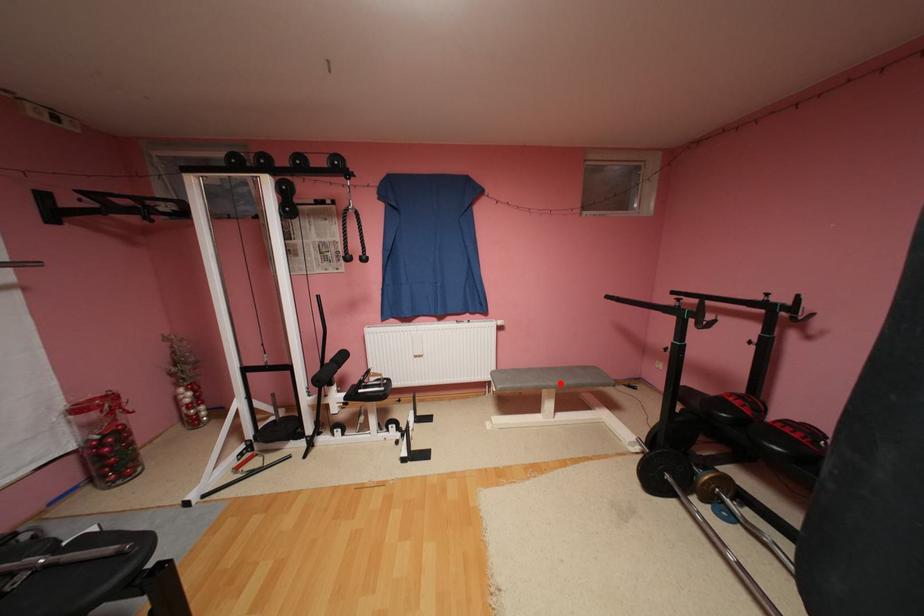
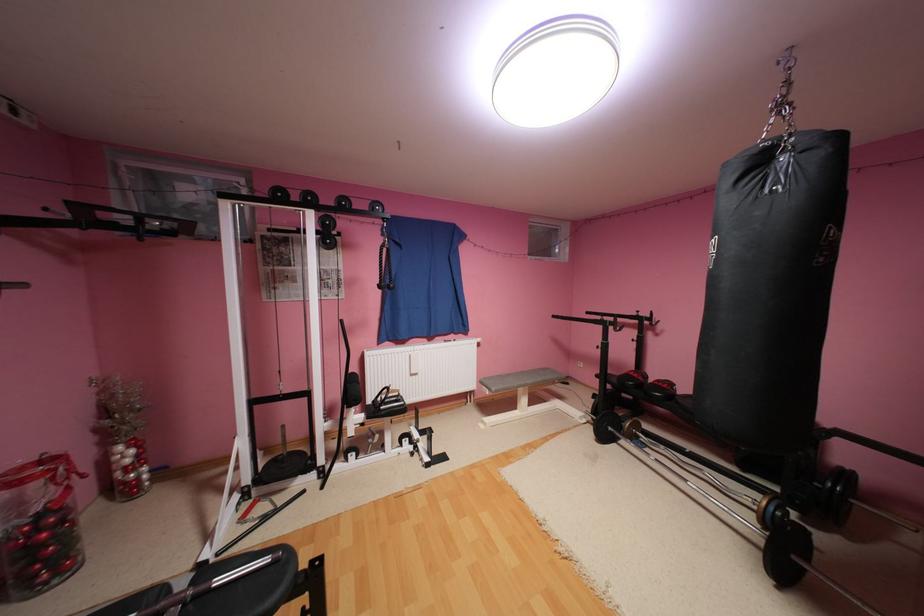
The point at the highlighted location is marked in the first image. Where is the corresponding point in the second image?

(538, 382)